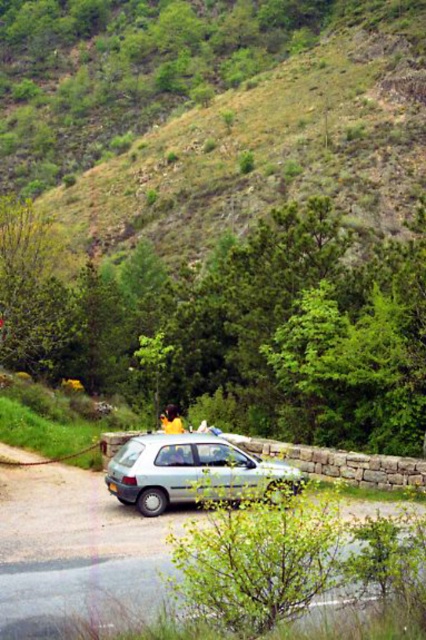
You are a delivery driver who needs to park your light blue metallic hatchback at center. There is a green grassy hillside at upper center nearby. Which direction should you move your car to avoid blocking the view of the hillside?

The green grassy hillside at upper center is positioned over the light blue metallic hatchback at center, so to avoid blocking the view of the hillside, you should move the light blue metallic hatchback at center downward away from the hillside.

You are a driver trying to park a car in a narrow road. You see a metallic silver car at center and a light blue metallic hatchback at center. Which car is closer to the right side of the road?

The metallic silver car at center is positioned on the right side of the light blue metallic hatchback at center, so it is closer to the right side of the road.

You are standing at the center of the road where the small light colored hatchback car is parked. Looking towards the green grassy hillside at upper center, in which direction should you walk to reach it?

The green grassy hillside at upper center is located at point (224, 124), so you should walk towards the upper center direction to reach it.